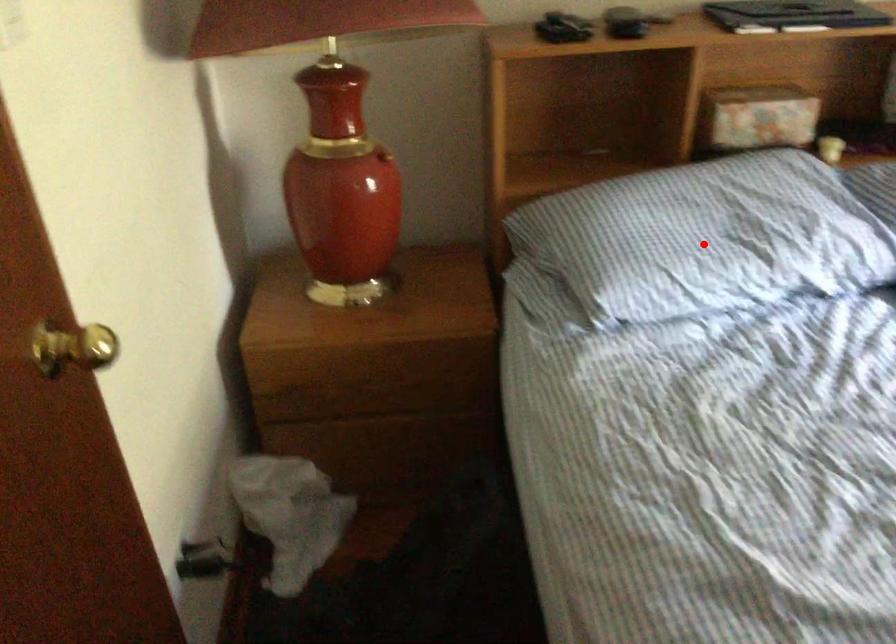
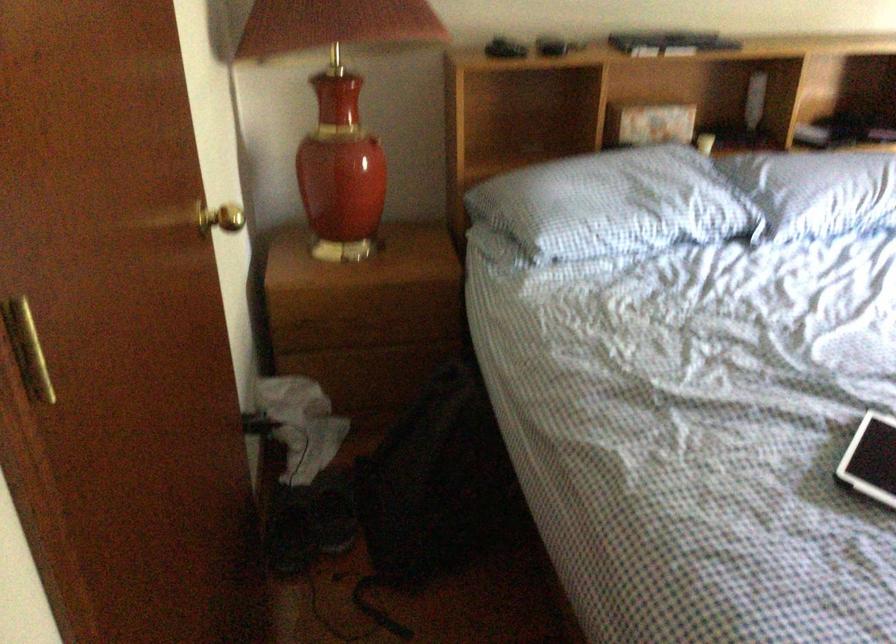
The point at the highlighted location is marked in the first image. Where is the corresponding point in the second image?

(613, 204)